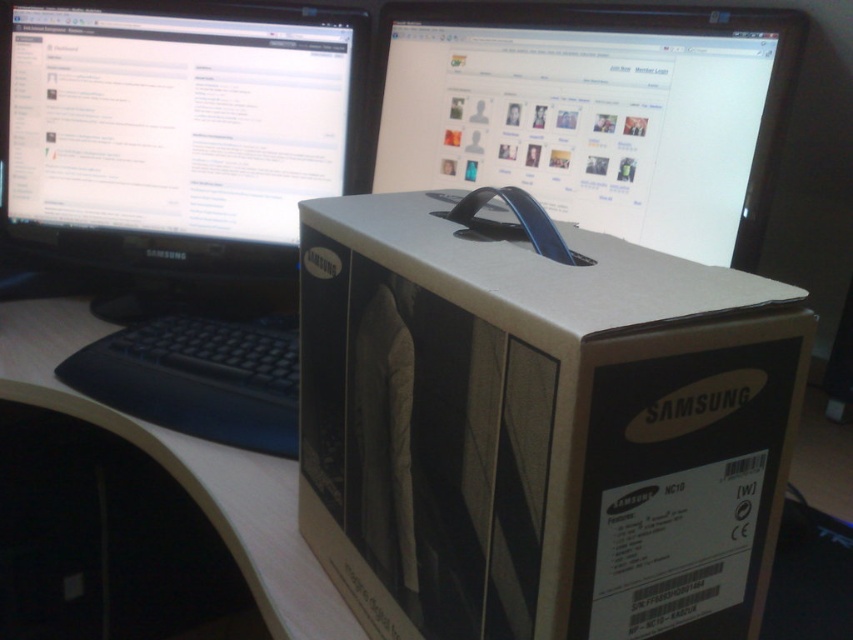
Can you confirm if black glossy monitor at upper left is positioned to the left of matte black monitor at center?

Correct, you'll find black glossy monitor at upper left to the left of matte black monitor at center.

Can you confirm if black glossy monitor at upper left is smaller than matte black monitor at center?

Yes, black glossy monitor at upper left is smaller than matte black monitor at center.

You are a GUI agent. You are given a task and a screenshot of the screen. Output one action in this format:
    pyautogui.click(x=<x>, y=<y>)
    Task: Click on the black glossy monitor at upper left
    Image resolution: width=853 pixels, height=640 pixels.
    Given the screenshot: What is the action you would take?
    pyautogui.click(x=177, y=141)

Find the location of a particular element. The width and height of the screenshot is (853, 640). black glossy monitor at upper left is located at coordinates (177, 141).

Between matte black monitor at center and black plastic keyboard at lower left, which one is positioned higher?

Positioned higher is matte black monitor at center.

Does matte black monitor at center have a greater height compared to black plastic keyboard at lower left?

Indeed, matte black monitor at center has a greater height compared to black plastic keyboard at lower left.

Which is behind, point (756, 109) or point (164, 378)?

The point (164, 378) is behind.

Locate an element on the screen. The height and width of the screenshot is (640, 853). matte black monitor at center is located at coordinates (595, 113).

Does black glossy monitor at upper left have a greater height compared to black plastic keyboard at lower left?

Correct, black glossy monitor at upper left is much taller as black plastic keyboard at lower left.

Does black glossy monitor at upper left have a greater width compared to black plastic keyboard at lower left?

Correct, the width of black glossy monitor at upper left exceeds that of black plastic keyboard at lower left.

What do you see at coordinates (177, 141) in the screenshot? I see `black glossy monitor at upper left` at bounding box center [177, 141].

Where is `black glossy monitor at upper left`? The width and height of the screenshot is (853, 640). black glossy monitor at upper left is located at coordinates (177, 141).